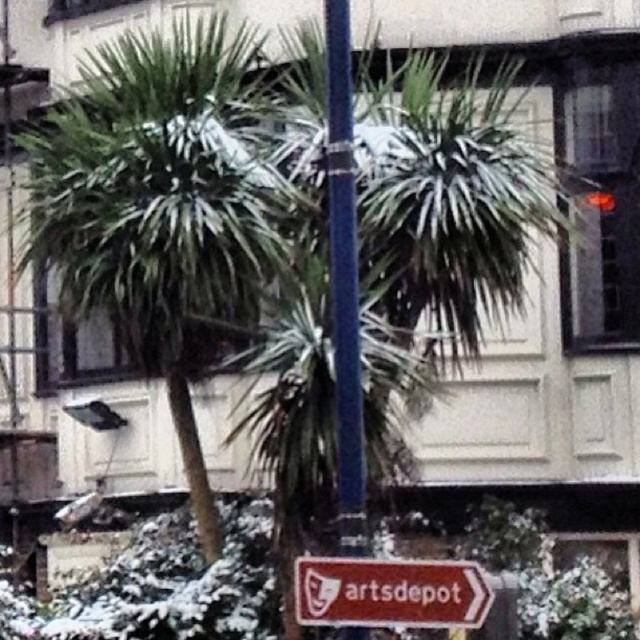
Does point (106, 65) come farther from viewer compared to point (464, 582)?

Yes, it is behind point (464, 582).

Between point (243, 180) and point (305, 564), which one is positioned behind?

Point (243, 180)

In order to click on green leafy palm tree at center in this screenshot , I will do `click(163, 209)`.

Between smooth blue pole at center and brown paper sign at lower center, which one has more height?

With more height is smooth blue pole at center.

Can you confirm if smooth blue pole at center is thinner than brown paper sign at lower center?

Yes.

Which is behind, point (346, 17) or point (317, 602)?

The point (346, 17) is more distant.

Locate an element on the screen. This screenshot has width=640, height=640. smooth blue pole at center is located at coordinates (344, 284).

Is green leafy palm tree at center below smooth blue pole at center?

Yes.

This screenshot has height=640, width=640. Identify the location of green leafy palm tree at center. (163, 209).